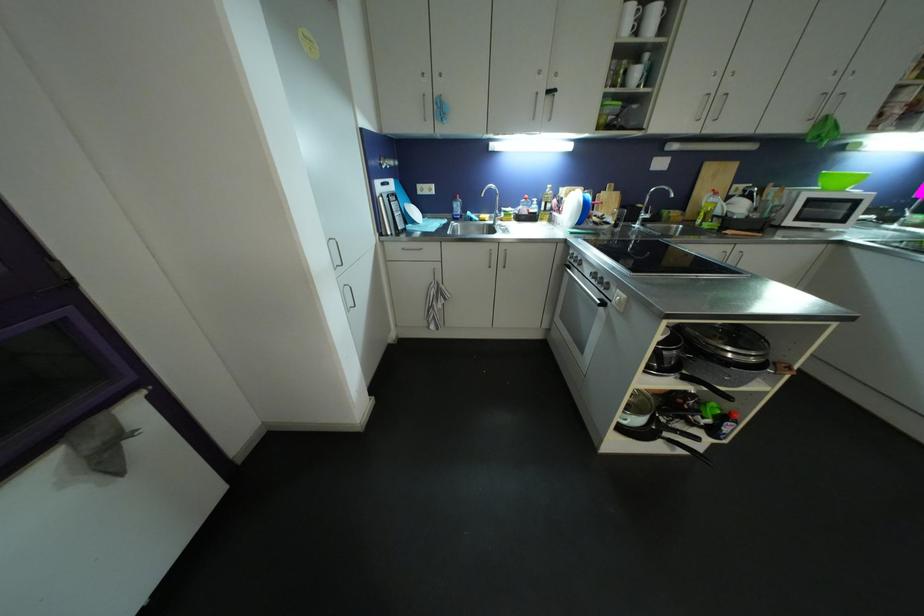
Find the location of a particular element. Image resolution: width=924 pixels, height=616 pixels. pot lid handle is located at coordinates (783, 370).